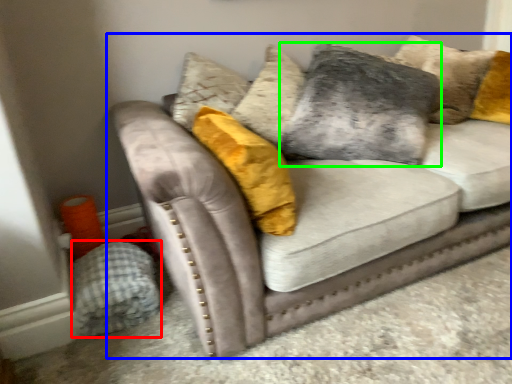
Question: Considering the real-world distances, which object is closest to material (highlighted by a red box)? studio couch (highlighted by a blue box) or pillow (highlighted by a green box).

Choices:
 (A) studio couch
 (B) pillow

Answer: (A)